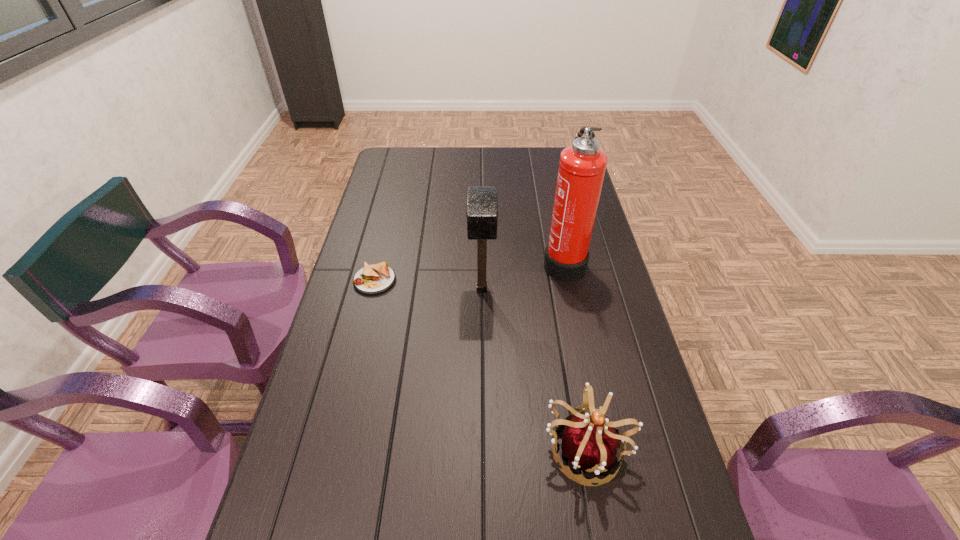
I want to click on the tallest object, so click(x=582, y=166).

Locate an element on the screen. the second tallest object is located at coordinates (482, 203).

Locate an element on the screen. Image resolution: width=960 pixels, height=540 pixels. the third object from right to left is located at coordinates (482, 203).

The width and height of the screenshot is (960, 540). Find the location of `tiara`. tiara is located at coordinates (590, 442).

Identify the location of the nearest object. The height and width of the screenshot is (540, 960). (590, 442).

The width and height of the screenshot is (960, 540). Identify the location of the shortest object. (373, 279).

Where is `sandwich`? This screenshot has height=540, width=960. sandwich is located at coordinates (373, 279).

Find the location of a particular element. Image resolution: width=960 pixels, height=540 pixels. free space located 0.150m on the front-facing side of the fire extinguisher is located at coordinates (497, 262).

Locate an element on the screen. Image resolution: width=960 pixels, height=540 pixels. vacant area located 0.120m on the front-facing side of the fire extinguisher is located at coordinates (506, 262).

In order to click on vacant region located on the front-facing side of the fire extinguisher in this screenshot , I will do `click(485, 262)`.